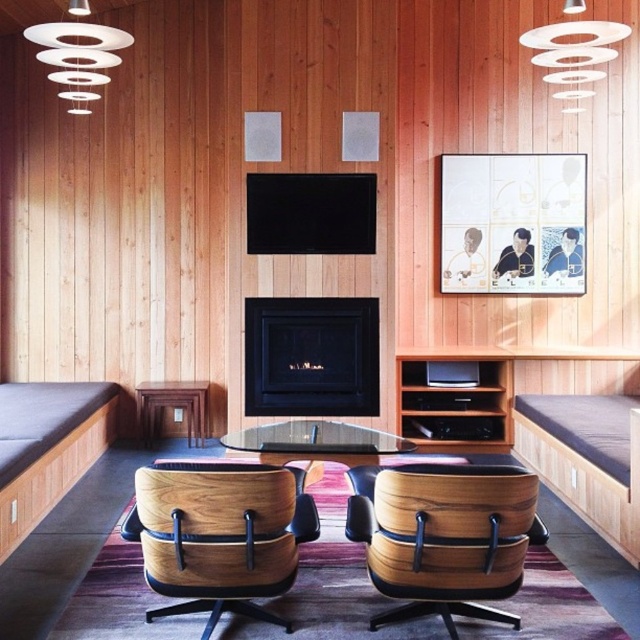
You are arranging a party in the living room and need to place a large centerpiece on the table. Which table should you choose between the transparent glass table at center and the wooden table at center to ensure the centerpiece will fit?

The wooden table at center is above the transparent glass table at center, so the wooden table at center is larger and can accommodate the centerpiece.

You are planning to place a large rectangular coffee table in the living room. The room has a transparent glass table at center and a wooden table at center. Which table should you choose to accommodate a 1.5 meter long decorative item?

The transparent glass table at center has a larger size compared to wooden table at center, so you should choose the transparent glass table at center to accommodate the 1.5 meter long decorative item.